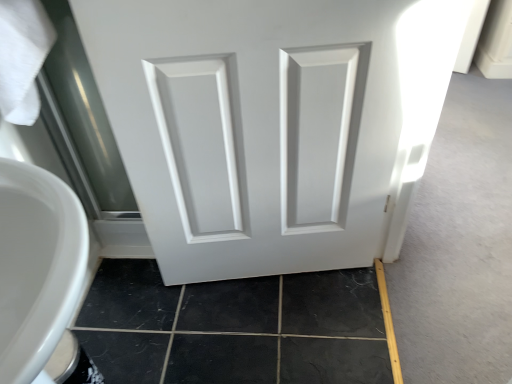
Question: Is black tile at lower left facing away from white matte door at center?

Choices:
 (A) no
 (B) yes

Answer: (A)

Question: Does black tile at lower left contain white matte door at center?

Choices:
 (A) yes
 (B) no

Answer: (B)

Question: From the image's perspective, is black tile at lower left located above white matte door at center?

Choices:
 (A) yes
 (B) no

Answer: (B)

Question: Considering the relative positions of black tile at lower left and white matte door at center in the image provided, is black tile at lower left to the left of white matte door at center from the viewer's perspective?

Choices:
 (A) yes
 (B) no

Answer: (A)

Question: Does black tile at lower left touch white matte door at center?

Choices:
 (A) no
 (B) yes

Answer: (A)

Question: Does black tile at lower left have a greater width compared to white matte door at center?

Choices:
 (A) no
 (B) yes

Answer: (B)

Question: Is white matte door at center not close to black tile at lower left?

Choices:
 (A) yes
 (B) no

Answer: (B)

Question: Is white matte door at center surrounding black tile at lower left?

Choices:
 (A) no
 (B) yes

Answer: (A)

Question: Can you confirm if white matte door at center is positioned to the left of black tile at lower left?

Choices:
 (A) no
 (B) yes

Answer: (A)

Question: Does white matte door at center come in front of black tile at lower left?

Choices:
 (A) yes
 (B) no

Answer: (A)

Question: Is white matte door at center bigger than black tile at lower left?

Choices:
 (A) yes
 (B) no

Answer: (A)

Question: Is white matte door at center to the right of black tile at lower left from the viewer's perspective?

Choices:
 (A) yes
 (B) no

Answer: (A)

Question: From their relative heights in the image, would you say white matte door at center is taller or shorter than black tile at lower left?

Choices:
 (A) tall
 (B) short

Answer: (A)